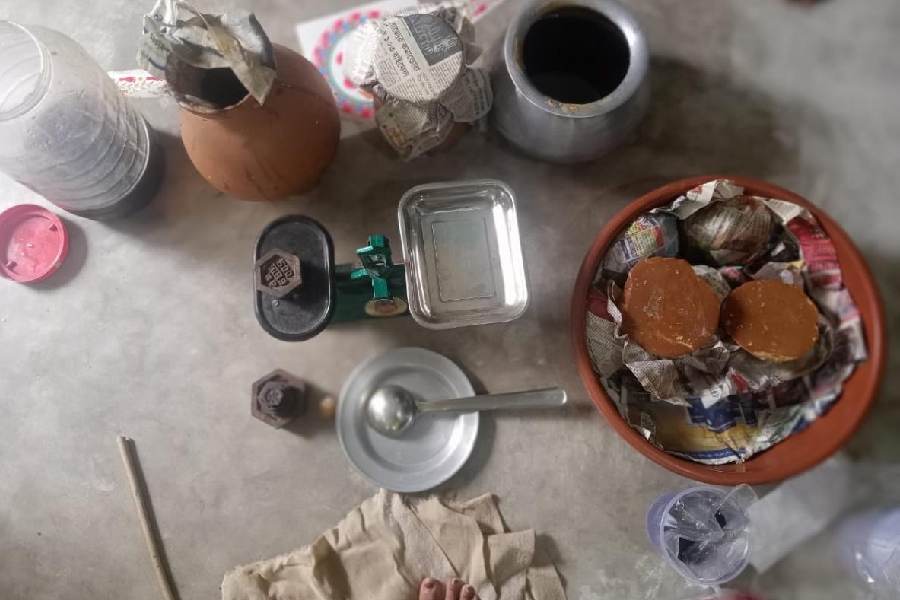
Find the location of a particular element. This screenshot has height=600, width=900. round brown potted bowl is located at coordinates (817, 452).